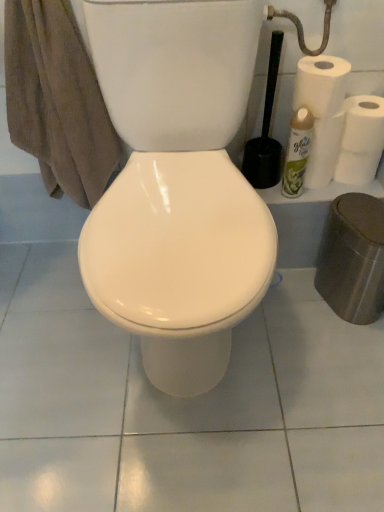
Locate an element on the screen. Image resolution: width=384 pixels, height=512 pixels. brown cotton towel at left is located at coordinates (57, 101).

The width and height of the screenshot is (384, 512). Describe the element at coordinates (297, 152) in the screenshot. I see `green matte air freshener at right` at that location.

Identify the location of brown cotton towel at left. This screenshot has height=512, width=384. (57, 101).

Considering the positions of point (379, 128) and point (316, 112), is point (379, 128) closer or farther from the camera than point (316, 112)?

Clearly, point (379, 128) is more distant from the camera than point (316, 112).

Does white matte toilet paper at right have a lesser width compared to white matte paper towel at upper right, which ranks as the 1th paper towel in left-to-right order?

In fact, white matte toilet paper at right might be wider than white matte paper towel at upper right, which ranks as the 1th paper towel in left-to-right order.

Is white matte toilet paper at right far from white matte paper towel at upper right, positioned as the first paper towel in front-to-back order?

No, white matte toilet paper at right is not far away from white matte paper towel at upper right, positioned as the first paper towel in front-to-back order.

Who is more distant, white matte toilet paper at right or white matte paper towel at upper right, positioned as the first paper towel in front-to-back order?

white matte toilet paper at right is further away from the camera.

Considering the relative sizes of white matte paper towel at upper right, which appears as the first paper towel when viewed from the top, and white matte paper towel at upper right, marked as the 1th paper towel in a bottom-to-top arrangement, in the image provided, is white matte paper towel at upper right, which appears as the first paper towel when viewed from the top, shorter than white matte paper towel at upper right, marked as the 1th paper towel in a bottom-to-top arrangement,?

Incorrect, the height of white matte paper towel at upper right, which appears as the first paper towel when viewed from the top, does not fall short of that of white matte paper towel at upper right, marked as the 1th paper towel in a bottom-to-top arrangement.

Visually, is white matte paper towel at upper right, positioned as the second paper towel in back-to-front order, positioned to the left or to the right of white matte paper towel at upper right, marked as the 1th paper towel in a bottom-to-top arrangement?

white matte paper towel at upper right, positioned as the second paper towel in back-to-front order, is to the left of white matte paper towel at upper right, marked as the 1th paper towel in a bottom-to-top arrangement.

From the picture: Is white matte paper towel at upper right, which ranks as the 1th paper towel in left-to-right order, facing towards white matte paper towel at upper right, marked as the second paper towel in a front-to-back arrangement?

No, white matte paper towel at upper right, which ranks as the 1th paper towel in left-to-right order, is not oriented towards white matte paper towel at upper right, marked as the second paper towel in a front-to-back arrangement.

Between black plastic toilet brush at right and white matte paper towel at upper right, positioned as the first paper towel in front-to-back order, which one has smaller size?

Smaller between the two is white matte paper towel at upper right, positioned as the first paper towel in front-to-back order.

Which object is more forward, black plastic toilet brush at right or white matte paper towel at upper right, the second paper towel in the bottom-to-top sequence?

black plastic toilet brush at right.

From the image's perspective, is black plastic toilet brush at right under white matte paper towel at upper right, which appears as the first paper towel when viewed from the top?

Yes, from the image's perspective, black plastic toilet brush at right is below white matte paper towel at upper right, which appears as the first paper towel when viewed from the top.

Can you confirm if black plastic toilet brush at right is positioned to the right of green matte air freshener at right?

No, black plastic toilet brush at right is not to the right of green matte air freshener at right.

This screenshot has height=512, width=384. Find the location of `cleaning product below the black plastic toilet brush at right (from a real-world perspective)`. cleaning product below the black plastic toilet brush at right (from a real-world perspective) is located at coordinates (297, 152).

From the picture: Measure the distance between black plastic toilet brush at right and green matte air freshener at right.

9.43 centimeters.

Is point (263, 150) closer or farther from the camera than point (293, 173)?

Point (263, 150) appears to be farther away from the viewer than point (293, 173).

Which is more to the left, brown cotton towel at left or white matte paper towel at upper right, which appears as the first paper towel when viewed from the top?

From the viewer's perspective, brown cotton towel at left appears more on the left side.

In the scene shown: Is brown cotton towel at left located outside white matte paper towel at upper right, which ranks as the 1th paper towel in left-to-right order?

Yes, brown cotton towel at left is outside of white matte paper towel at upper right, which ranks as the 1th paper towel in left-to-right order.

Based on the photo, is brown cotton towel at left aimed at white matte paper towel at upper right, which appears as the first paper towel when viewed from the top?

No, brown cotton towel at left is not turned towards white matte paper towel at upper right, which appears as the first paper towel when viewed from the top.

Which object is positioned more to the right, white matte paper towel at upper right, positioned as the second paper towel in back-to-front order, or brown cotton towel at left?

white matte paper towel at upper right, positioned as the second paper towel in back-to-front order.

What's the angular difference between white matte paper towel at upper right, positioned as the first paper towel in front-to-back order, and brown cotton towel at left's facing directions?

white matte paper towel at upper right, positioned as the first paper towel in front-to-back order, and brown cotton towel at left are facing 0.803 degrees away from each other.

Which point is more distant from viewer, (350, 68) or (29, 60)?

The point (350, 68) is more distant.

Considering their positions, is green matte air freshener at right located in front of or behind white matte paper towel at upper right, the second paper towel in the bottom-to-top sequence?

Clearly, green matte air freshener at right is behind white matte paper towel at upper right, the second paper towel in the bottom-to-top sequence.

Considering the relative positions of green matte air freshener at right and white matte paper towel at upper right, positioned as the second paper towel in back-to-front order, in the image provided, is green matte air freshener at right to the left or to the right of white matte paper towel at upper right, positioned as the second paper towel in back-to-front order,?

Clearly, green matte air freshener at right is on the left of white matte paper towel at upper right, positioned as the second paper towel in back-to-front order, in the image.

Locate an element on the screen. This screenshot has width=384, height=512. paper towel above the white matte toilet paper at right (from a real-world perspective) is located at coordinates (321, 84).

Where is `paper towel lying above the white matte paper towel at upper right, the first paper towel positioned from the back (from the image's perspective)`? paper towel lying above the white matte paper towel at upper right, the first paper towel positioned from the back (from the image's perspective) is located at coordinates (321, 84).

Based on their spatial positions, is green matte air freshener at right or white matte paper towel at upper right, the first paper towel positioned from the back, further from brown cotton towel at left?

Among the two, white matte paper towel at upper right, the first paper towel positioned from the back, is located further to brown cotton towel at left.

Looking at this image, from the image, which object appears to be nearer to brown cotton towel at left, white matte toilet paper at right or white matte paper towel at upper right, which ranks as the 1th paper towel in left-to-right order?

white matte paper towel at upper right, which ranks as the 1th paper towel in left-to-right order.

Which object lies further to the anchor point black plastic toilet brush at right, green matte air freshener at right or brown cotton towel at left?

Among the two, brown cotton towel at left is located further to black plastic toilet brush at right.

Looking at the image, which one is located further to white matte paper towel at upper right, positioned as the second paper towel in back-to-front order, white matte toilet paper at right or black plastic toilet brush at right?

The object further to white matte paper towel at upper right, positioned as the second paper towel in back-to-front order, is black plastic toilet brush at right.

Which object lies further to the anchor point black plastic toilet brush at right, white matte paper towel at upper right, which ranks as the 1th paper towel in left-to-right order, or brown cotton towel at left?

Based on the image, brown cotton towel at left appears to be further to black plastic toilet brush at right.

From the image, which object appears to be nearer to brown cotton towel at left, white matte toilet paper at right or black plastic toilet brush at right?

Among the two, black plastic toilet brush at right is located nearer to brown cotton towel at left.

Estimate the real-world distances between objects in this image. Which object is closer to black plastic toilet brush at right, white matte toilet paper at right or green matte air freshener at right?

Based on the image, green matte air freshener at right appears to be nearer to black plastic toilet brush at right.

Looking at the image, which one is located closer to black plastic toilet brush at right, white matte paper towel at upper right, the second paper towel in the bottom-to-top sequence, or white matte toilet paper at right?

Based on the image, white matte paper towel at upper right, the second paper towel in the bottom-to-top sequence, appears to be nearer to black plastic toilet brush at right.

At what (x,y) coordinates should I click in order to perform the action: click on cleaning product between brown cotton towel at left and white matte toilet paper at right from left to right. Please return your answer as a coordinate pair (x, y). The height and width of the screenshot is (512, 384). Looking at the image, I should click on (297, 152).

Identify the location of paper towel between black plastic toilet brush at right and white matte paper towel at upper right, which appears as the 2th paper towel when viewed from the top, from left to right. (321, 84).

Where is `paper towel between brown cotton towel at left and white matte paper towel at upper right, the first paper towel positioned from the back, from left to right`? This screenshot has width=384, height=512. paper towel between brown cotton towel at left and white matte paper towel at upper right, the first paper towel positioned from the back, from left to right is located at coordinates (321, 84).

At what (x,y) coordinates should I click in order to perform the action: click on toilet paper located between white matte paper towel at upper right, which appears as the first paper towel when viewed from the top, and white matte paper towel at upper right, arranged as the first paper towel when viewed from the right, in the left-right direction. Please return your answer as a coordinate pair (x, y). Looking at the image, I should click on (361, 140).